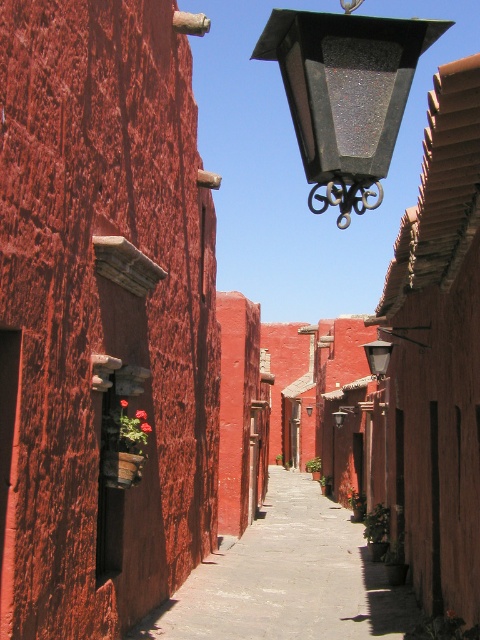
You are standing at the entrance of the alleyway and want to walk to the smooth concrete pavement at center. According to the image, in which direction should you move relative to your current position?

The smooth concrete pavement at center is located at point (288, 579), so you should move forward and towards the center of the alleyway to reach it.

You are a delivery person with a package that needs to be placed on either the smooth concrete pavement at center or the black textured lantern at upper center. Based on their sizes, which surface can accommodate the package more comfortably?

The smooth concrete pavement at center is larger in size than the black textured lantern at upper center, so the package will fit more comfortably on the smooth concrete pavement at center.